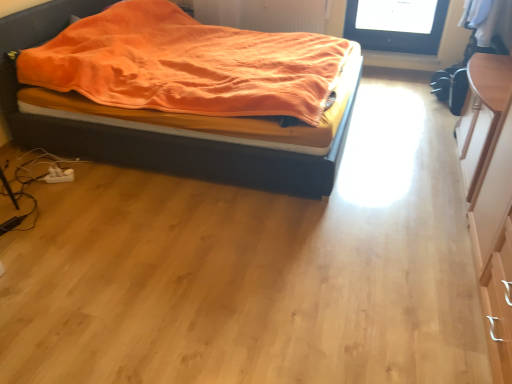
Find the location of a particular element. The height and width of the screenshot is (384, 512). free location in front of orange soft fabric bed at left is located at coordinates (227, 259).